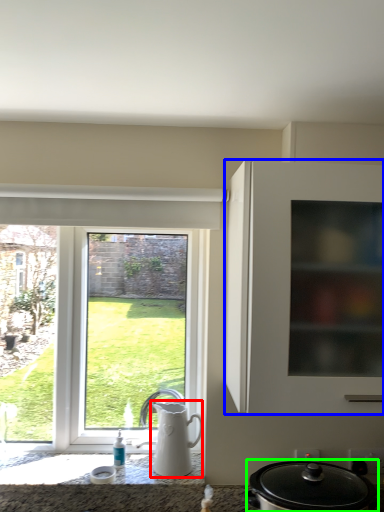
Question: Which object is positioned closest to jug (highlighted by a red box)? Select from cabinetry (highlighted by a blue box) and kitchen appliance (highlighted by a green box).

Choices:
 (A) cabinetry
 (B) kitchen appliance

Answer: (B)